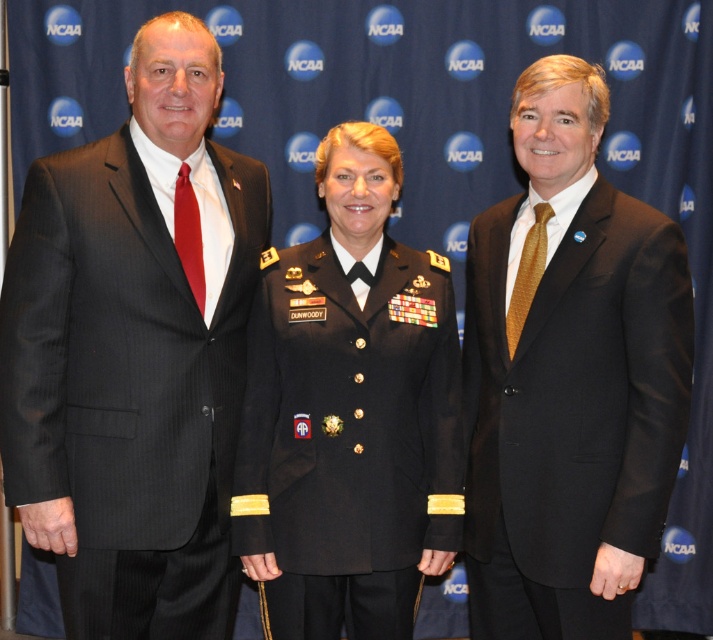
Question: Which point appears farthest from the camera in this image?

Choices:
 (A) (169, 35)
 (B) (553, 394)
 (C) (384, 369)

Answer: (C)

Question: Which point is farther to the camera?

Choices:
 (A) black uniform at center
 (B) matte black suit at center
 (C) matte black suit at left

Answer: (A)

Question: Is matte black suit at left wider than black uniform at center?

Choices:
 (A) no
 (B) yes

Answer: (A)

Question: Can you confirm if matte black suit at left is positioned above matte black suit at center?

Choices:
 (A) yes
 (B) no

Answer: (A)

Question: Does matte black suit at left appear over matte black suit at center?

Choices:
 (A) no
 (B) yes

Answer: (B)

Question: Which of the following is the farthest from the observer?

Choices:
 (A) matte black suit at left
 (B) black uniform at center

Answer: (B)